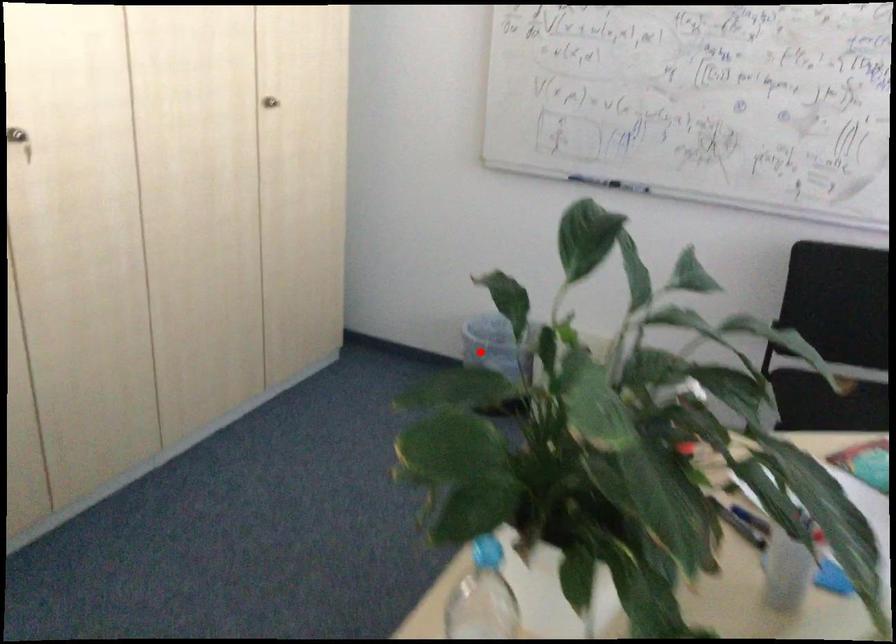
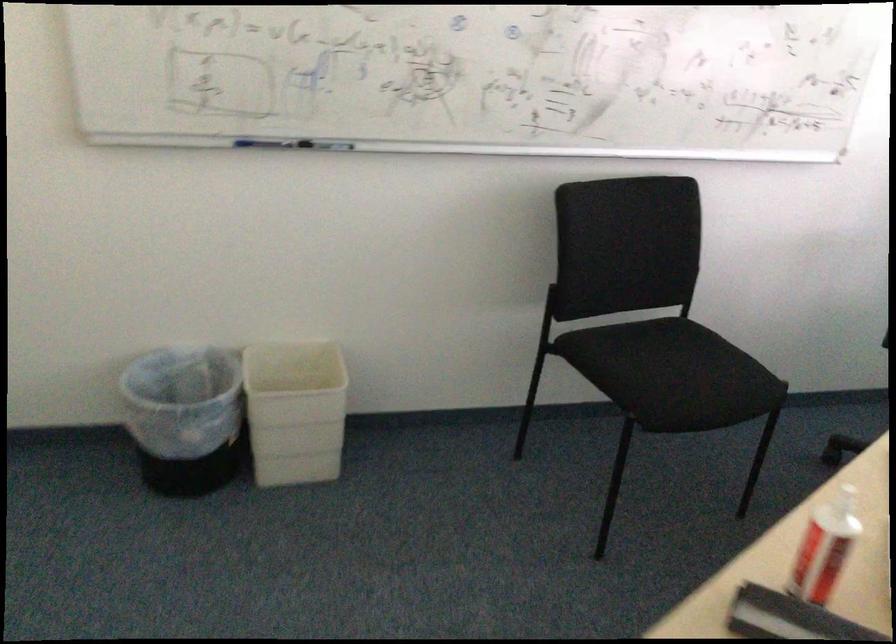
Question: I am providing you with two images of the same scene from different viewpoints. A red point is shown in image1. For the corresponding object point in image2, is it positioned nearer or farther from the camera?

Choices:
 (A) Nearer
 (B) Farther

Answer: (A)